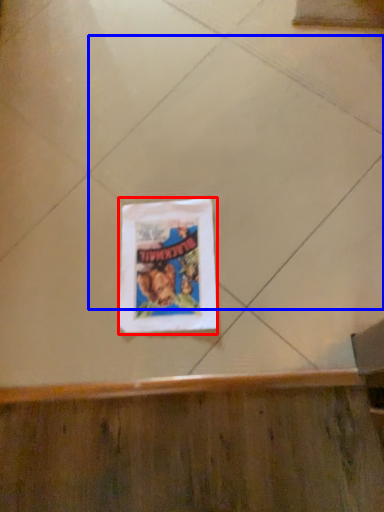
Question: Which point is further to the camera, picture frame (highlighted by a red box) or ceramic tile (highlighted by a blue box)?

Choices:
 (A) picture frame
 (B) ceramic tile

Answer: (A)